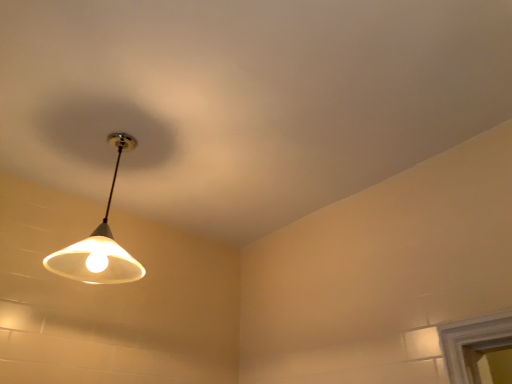
Measure the distance between point (52,263) and camera.

A distance of 5.82 feet exists between point (52,263) and camera.

Where is `white matte lampshade at upper center`? The width and height of the screenshot is (512, 384). white matte lampshade at upper center is located at coordinates (99, 244).

Describe the element at coordinates (99, 244) in the screenshot. I see `white matte lampshade at upper center` at that location.

Where is `white matte lampshade at upper center`? white matte lampshade at upper center is located at coordinates (99, 244).